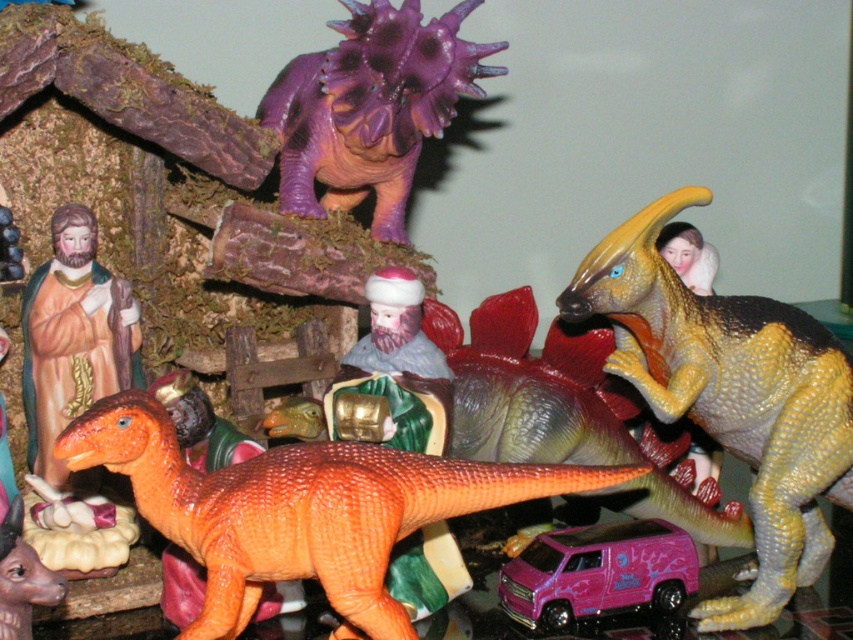
Between pink plastic van at lower center and matte plastic figure at center, which one appears on the right side from the viewer's perspective?

Positioned to the right is pink plastic van at lower center.

Between pink plastic van at lower center and matte plastic figure at center, which one appears on the left side from the viewer's perspective?

matte plastic figure at center

Who is more forward, (x=612, y=586) or (x=426, y=349)?

Positioned in front is point (x=612, y=586).

This screenshot has height=640, width=853. Identify the location of pink plastic van at lower center. (598, 573).

This screenshot has width=853, height=640. What do you see at coordinates (73, 337) in the screenshot?
I see `porcelain figure at left` at bounding box center [73, 337].

Which is in front, point (113, 355) or point (577, 563)?

Point (577, 563) is more forward.

Is point (42, 285) positioned in front of point (619, 605)?

That is False.

This screenshot has width=853, height=640. Identify the location of porcelain figure at left. (73, 337).

Based on the photo, does orange matte plastic dinosaur at center have a lesser height compared to purple matte stegosaurus at upper center?

Yes.

Which of these two, orange matte plastic dinosaur at center or purple matte stegosaurus at upper center, stands shorter?

Standing shorter between the two is orange matte plastic dinosaur at center.

You are a GUI agent. You are given a task and a screenshot of the screen. Output one action in this format:
    pyautogui.click(x=<x>, y=<y>)
    Task: Click on the orange matte plastic dinosaur at center
    This screenshot has height=640, width=853.
    Given the screenshot: What is the action you would take?
    pyautogui.click(x=300, y=508)